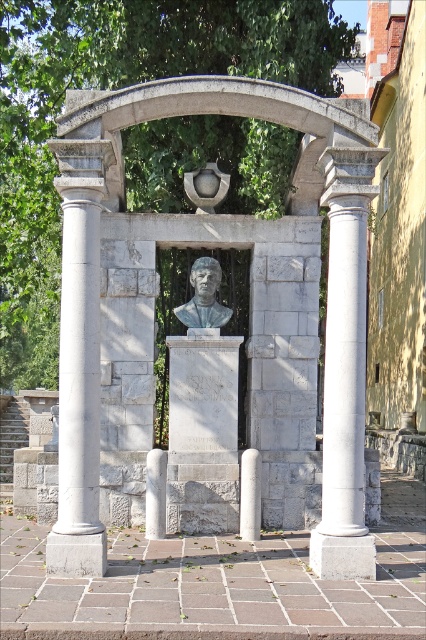
Who is lower down, white marble column at center or matte gray bust at center?

Positioned lower is white marble column at center.

The image size is (426, 640). Describe the element at coordinates (345, 368) in the screenshot. I see `white marble column at center` at that location.

Identify the location of white marble column at center. (345, 368).

Is point (60, 419) behind point (196, 304)?

No, (60, 419) is closer to viewer.

Does gray stone column at left appear on the right side of matte gray bust at center?

In fact, gray stone column at left is to the left of matte gray bust at center.

Which is behind, point (98, 576) or point (206, 257)?

The point (206, 257) is more distant.

Locate an element on the screen. The image size is (426, 640). gray stone column at left is located at coordinates (78, 360).

Does point (57, 129) lie behind point (72, 211)?

That is False.

Locate an element on the screen. This screenshot has height=640, width=426. gray stone bust at center is located at coordinates tap(250, 308).